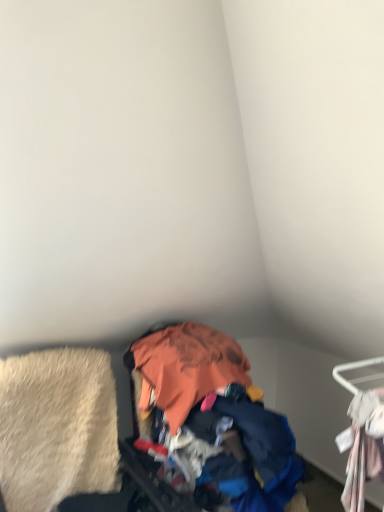
Question: Is beige shag rug at lower left situated inside orange fabric pile at center or outside?

Choices:
 (A) outside
 (B) inside

Answer: (A)

Question: In the image, is beige shag rug at lower left positioned in front of or behind orange fabric pile at center?

Choices:
 (A) front
 (B) behind

Answer: (B)

Question: Considering the real-world distances, which object is closest to the white fabric hanger at right?

Choices:
 (A) beige shag rug at lower left
 (B) orange fabric pile at center

Answer: (B)

Question: Which of these objects is positioned farthest from the beige shag rug at lower left?

Choices:
 (A) white fabric hanger at right
 (B) orange fabric pile at center

Answer: (A)